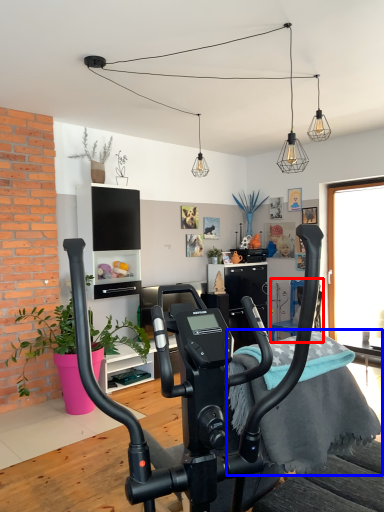
Question: Which point is further to the camera, armchair (highlighted by a red box) or bedding (highlighted by a blue box)?

Choices:
 (A) armchair
 (B) bedding

Answer: (A)